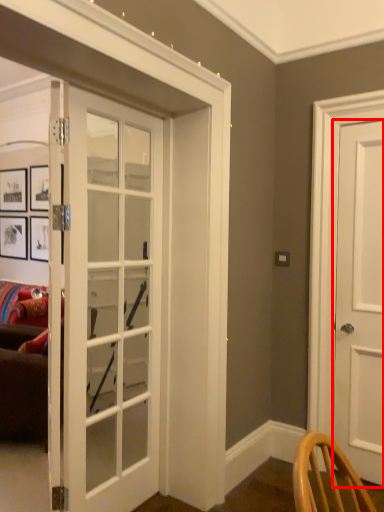
Question: From the image, what is the correct spatial relationship of door (annotated by the red box) in relation to door?

Choices:
 (A) right
 (B) left

Answer: (A)